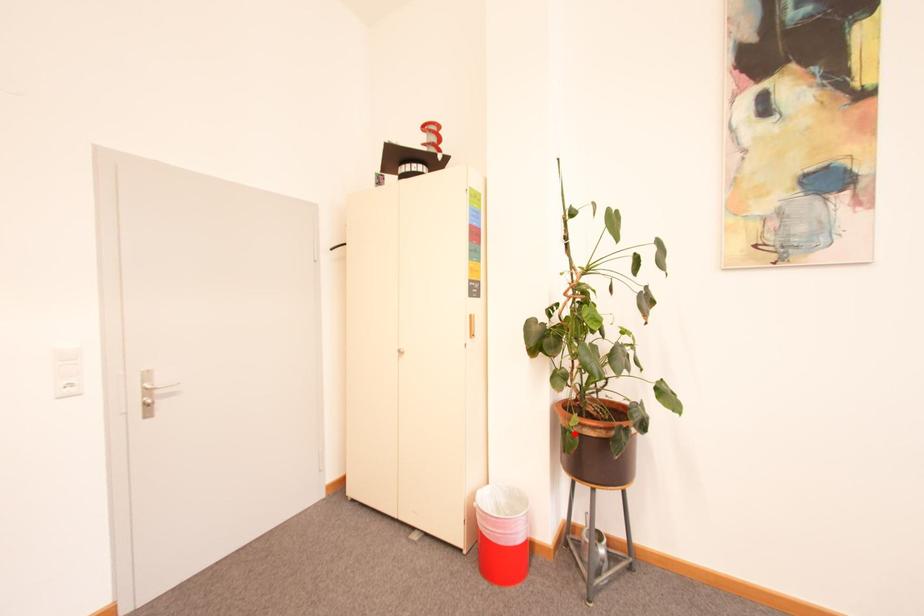
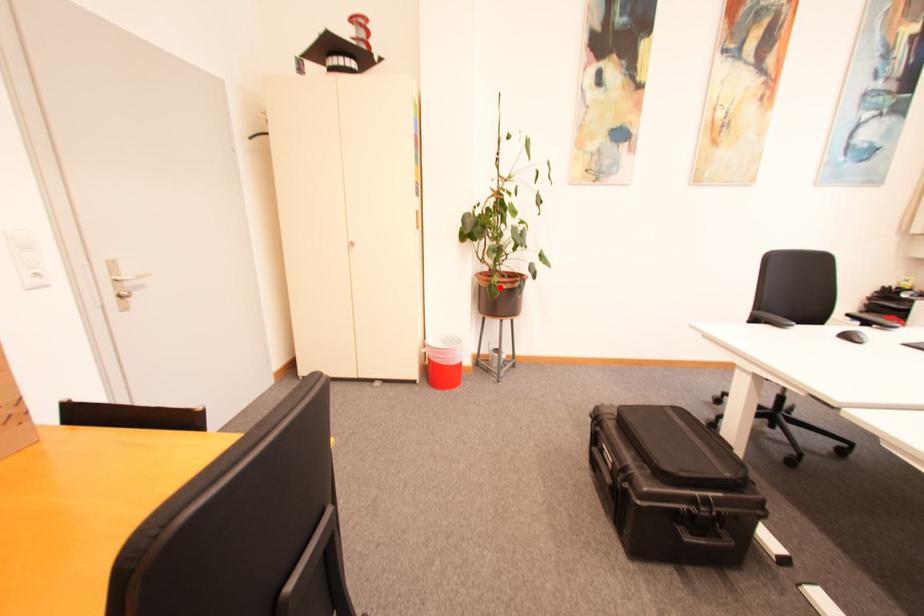
I am providing you with two images of the same scene from different viewpoints. A red point is marked on the first image and another point is marked on the second image. Is the red point in image1 aligned with the point shown in image2?

Yes